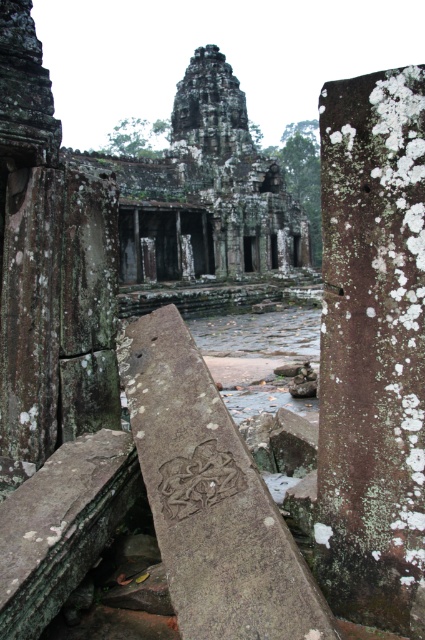
Question: Can you confirm if lichen-covered stone at center is smaller than brown stone carving at center?

Choices:
 (A) no
 (B) yes

Answer: (A)

Question: Which point is closer to the camera?

Choices:
 (A) brown stone carving at center
 (B) lichen-covered stone at center

Answer: (A)

Question: Can you confirm if lichen-covered stone at center is smaller than brown stone carving at center?

Choices:
 (A) no
 (B) yes

Answer: (A)

Question: Does lichen-covered stone at center appear on the left side of brown stone carving at center?

Choices:
 (A) no
 (B) yes

Answer: (A)